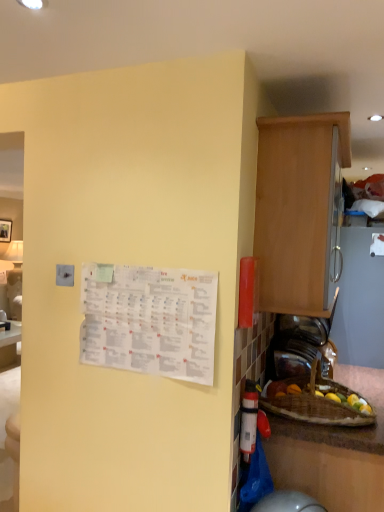
Question: Considering the relative positions of white paper calendar at upper left and light brown wood cabinet at right in the image provided, is white paper calendar at upper left behind light brown wood cabinet at right?

Choices:
 (A) no
 (B) yes

Answer: (A)

Question: From a real-world perspective, is white paper calendar at upper left below light brown wood cabinet at right?

Choices:
 (A) yes
 (B) no

Answer: (A)

Question: Considering the relative sizes of white paper calendar at upper left and light brown wood cabinet at right in the image provided, is white paper calendar at upper left shorter than light brown wood cabinet at right?

Choices:
 (A) no
 (B) yes

Answer: (B)

Question: Is white paper calendar at upper left thinner than light brown wood cabinet at right?

Choices:
 (A) no
 (B) yes

Answer: (B)

Question: Is white paper calendar at upper left next to light brown wood cabinet at right?

Choices:
 (A) no
 (B) yes

Answer: (A)

Question: Is white paper calendar at upper left to the left of light brown wood cabinet at right from the viewer's perspective?

Choices:
 (A) no
 (B) yes

Answer: (B)

Question: Considering the relative positions of light brown wood cabinet at right and white paper calendar at upper left in the image provided, is light brown wood cabinet at right in front of white paper calendar at upper left?

Choices:
 (A) yes
 (B) no

Answer: (B)

Question: Can you confirm if light brown wood cabinet at right is wider than white paper calendar at upper left?

Choices:
 (A) yes
 (B) no

Answer: (A)

Question: Is light brown wood cabinet at right looking in the opposite direction of white paper calendar at upper left?

Choices:
 (A) no
 (B) yes

Answer: (A)

Question: Is light brown wood cabinet at right positioned beyond the bounds of white paper calendar at upper left?

Choices:
 (A) no
 (B) yes

Answer: (B)

Question: Is light brown wood cabinet at right placed right next to white paper calendar at upper left?

Choices:
 (A) no
 (B) yes

Answer: (A)

Question: Does light brown wood cabinet at right lie behind white paper calendar at upper left?

Choices:
 (A) no
 (B) yes

Answer: (B)

Question: From the image's perspective, is light brown wood cabinet at right positioned above or below white paper calendar at upper left?

Choices:
 (A) above
 (B) below

Answer: (A)